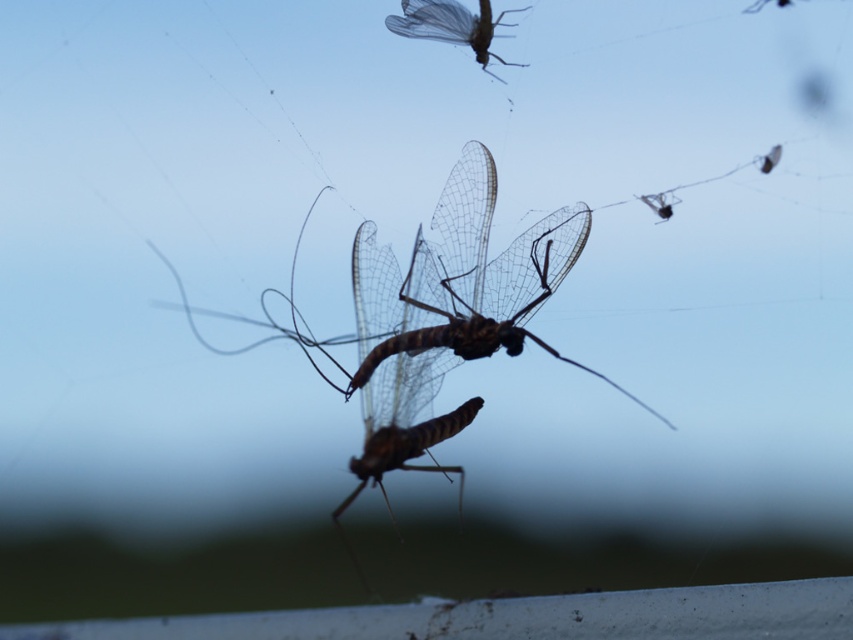
Question: Which point appears closest to the camera in this image?

Choices:
 (A) (503, 285)
 (B) (672, 198)
 (C) (416, 4)

Answer: (C)

Question: Considering the relative positions of translucent winged insect at upper center and translucent brown dragonfly at upper right in the image provided, where is translucent winged insect at upper center located with respect to translucent brown dragonfly at upper right?

Choices:
 (A) left
 (B) right

Answer: (A)

Question: Where is translucent winged insect at upper center located in relation to translucent brown dragonfly at upper right in the image?

Choices:
 (A) below
 (B) above

Answer: (B)

Question: Considering the relative positions of translucent brown insect at center and translucent winged insect at upper center in the image provided, where is translucent brown insect at center located with respect to translucent winged insect at upper center?

Choices:
 (A) left
 (B) right

Answer: (A)

Question: Which of the following is the closest to the observer?

Choices:
 (A) translucent brown dragonfly at upper right
 (B) translucent brown insect at center

Answer: (B)

Question: Among these points, which one is farthest from the camera?

Choices:
 (A) (653, 195)
 (B) (425, 33)
 (C) (198, 308)

Answer: (A)